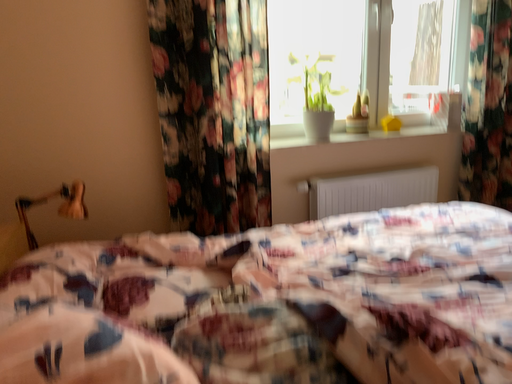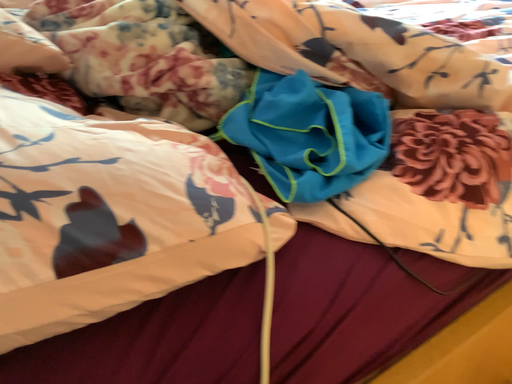
Question: How did the camera likely rotate when shooting the video?

Choices:
 (A) rotated downward
 (B) rotated upward

Answer: (A)